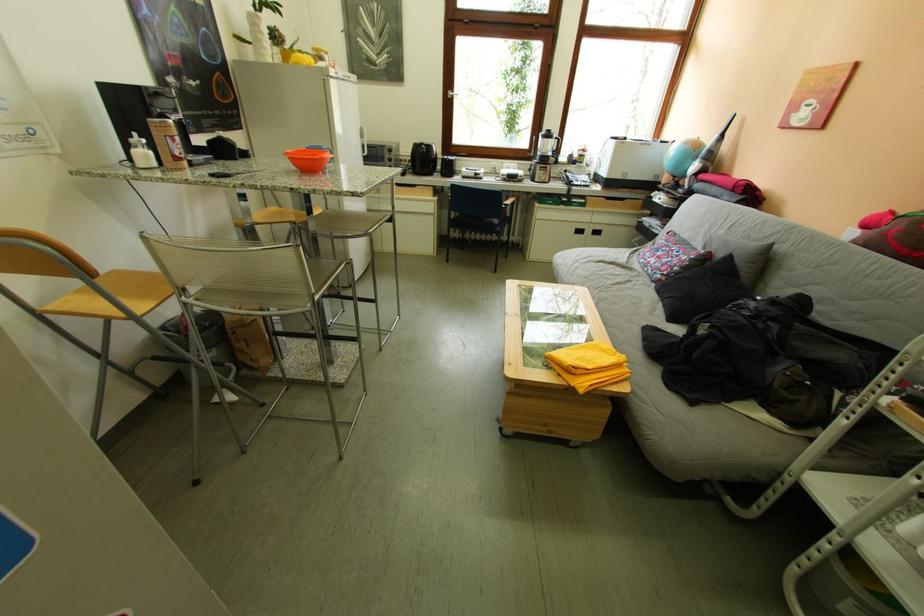
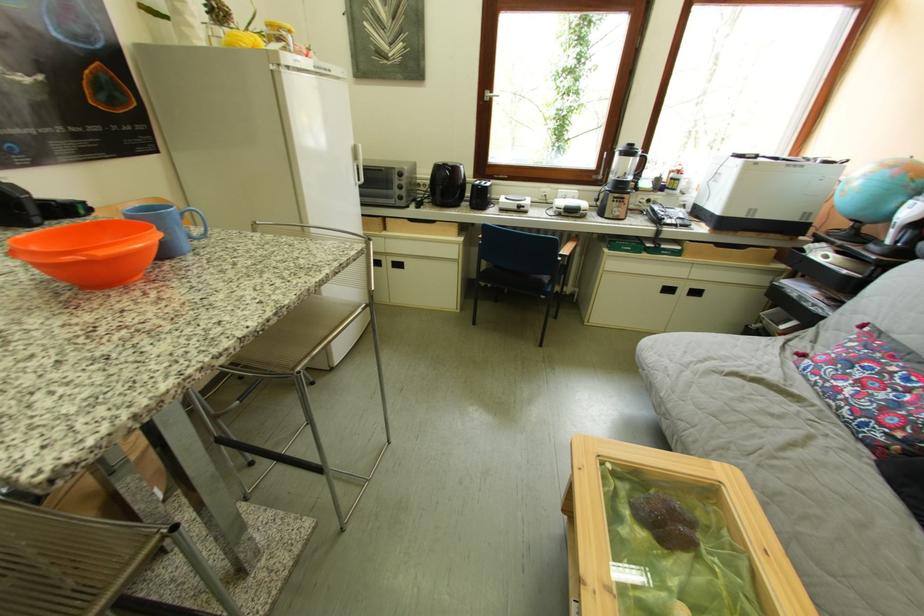
Where in the second image is the point corresponding to (x=335, y=159) from the first image?

(116, 256)